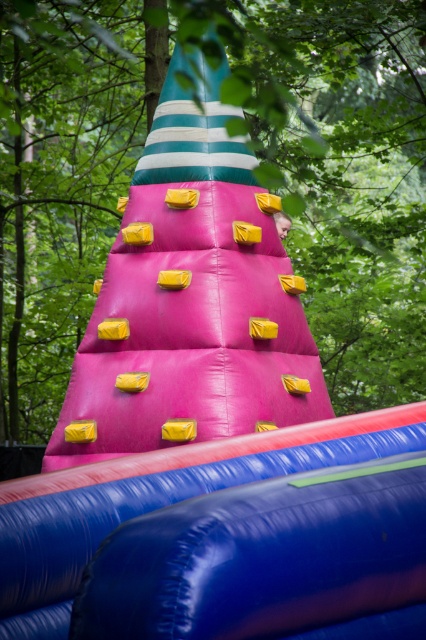
Question: From the image, what is the correct spatial relationship of green matte tree at center in relation to smooth skin head at center?

Choices:
 (A) above
 (B) below

Answer: (A)

Question: Is green matte tree at center to the right of blue rubber slide at lower center from the viewer's perspective?

Choices:
 (A) yes
 (B) no

Answer: (B)

Question: Which point is farther from the camera taking this photo?

Choices:
 (A) (69, 4)
 (B) (420, 420)

Answer: (A)

Question: Which object appears farthest from the camera in this image?

Choices:
 (A) blue rubber slide at lower center
 (B) smooth skin head at center

Answer: (B)

Question: Which object is the closest to the blue rubber slide at lower center?

Choices:
 (A) smooth skin head at center
 (B) green matte tree at center

Answer: (A)

Question: Is blue rubber slide at lower center below smooth skin head at center?

Choices:
 (A) no
 (B) yes

Answer: (B)